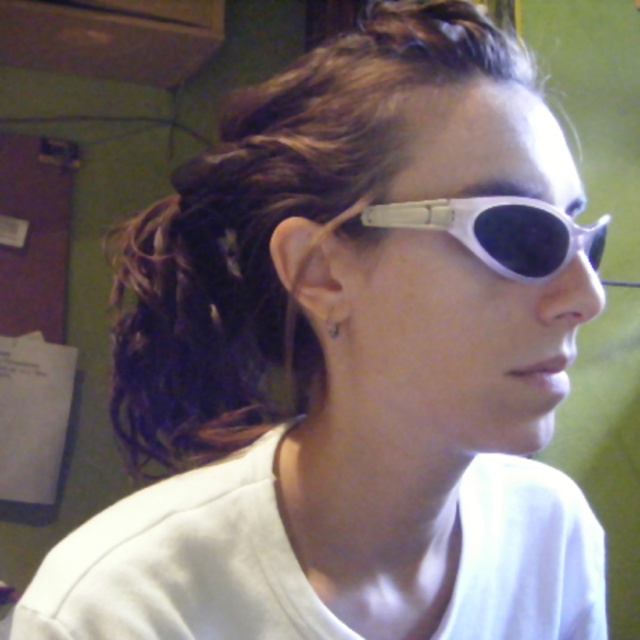
Question: Which point is farther from the camera taking this photo?

Choices:
 (A) (326, 336)
 (B) (472, 244)

Answer: (A)

Question: Does white matte sunglasses at upper center have a larger size compared to silver metallic earring at ear?

Choices:
 (A) yes
 (B) no

Answer: (A)

Question: Which point is farther from the camera taking this photo?

Choices:
 (A) (337, 330)
 (B) (518, 260)

Answer: (A)

Question: From the image, what is the correct spatial relationship of white matte sunglasses at upper center in relation to silver metallic earring at ear?

Choices:
 (A) above
 (B) below

Answer: (A)

Question: Does white matte sunglasses at upper center have a larger size compared to silver metallic earring at ear?

Choices:
 (A) no
 (B) yes

Answer: (B)